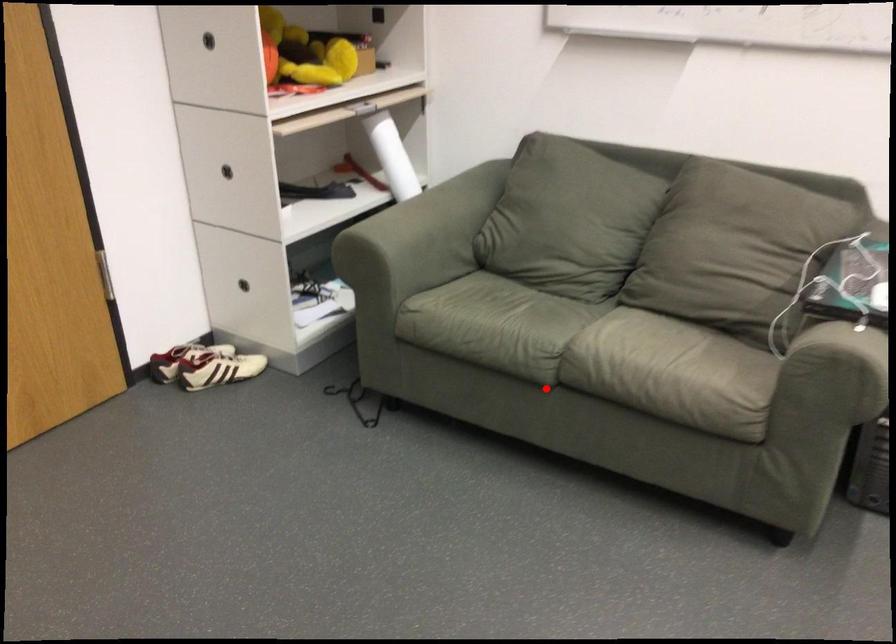
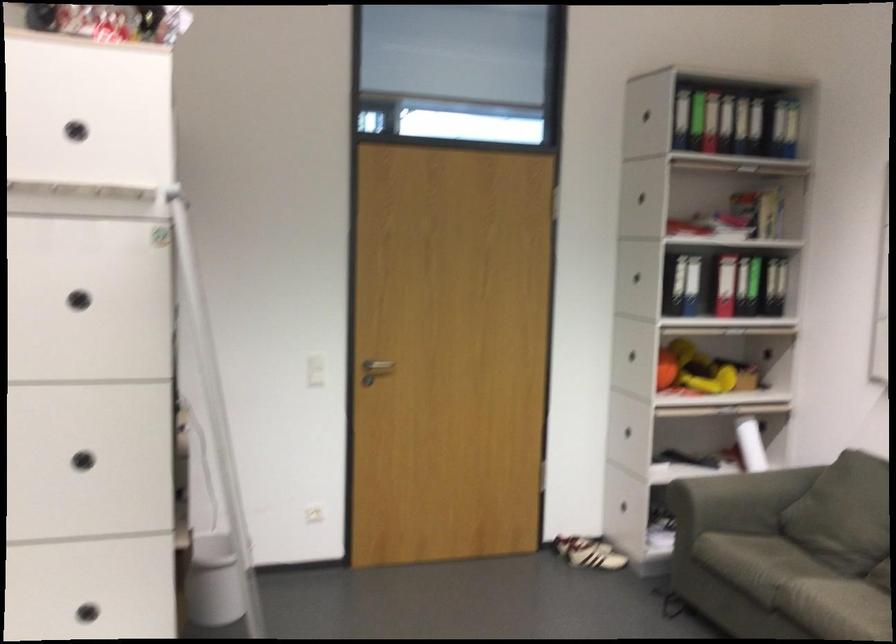
Question: I am providing you with two images of the same scene from different viewpoints. Given a red point in image1, look at the same physical point in image2. Is it:

Choices:
 (A) Closer to the viewpoint
 (B) Farther from the viewpoint

Answer: (B)